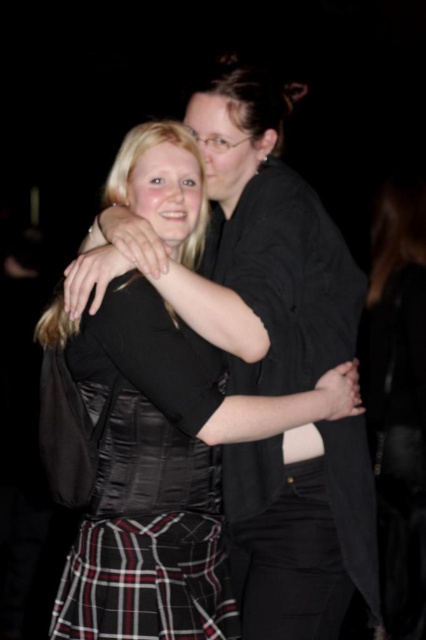
You are a photographer at a social event. You need to position a spotlight on the person wearing the satin black dress at center. Given that the spotlight can only cover an area within a 0.2 radius from its center, can you place the spotlight at coordinates point (149, 465) to effectively illuminate the satin black dress at center?

The point (149, 465) marks the satin black dress at center. Since the spotlight has a 0.2 radius, placing it at that exact coordinate will ensure the dress is fully within the illuminated area, so yes, the spotlight can be placed there.

Based on the scene description, can you determine which object is positioned to the right of the other between the satin black dress at center and the plaid fabric kilt at lower center?

The satin black dress at center is positioned to the right of the plaid fabric kilt at lower center according to the description.